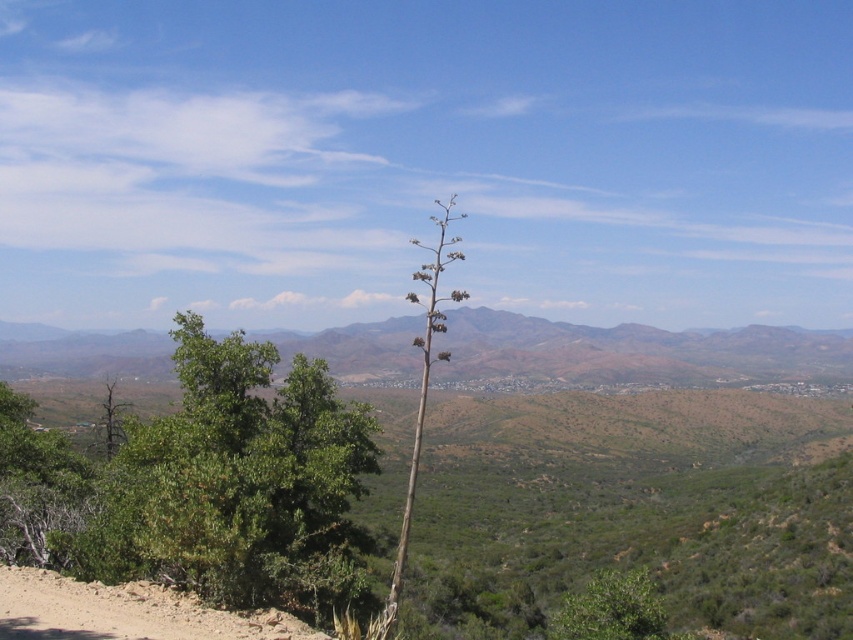
Is point (258, 465) positioned behind point (784, 371)?

No, (258, 465) is closer to viewer.

Consider the image. Is green leafy tree at left smaller than brown/dry grassland at center?

Yes.

Is point (236, 572) closer to viewer compared to point (813, 371)?

Yes, point (236, 572) is closer to viewer.

The image size is (853, 640). I want to click on green leafy tree at left, so click(241, 484).

Is green leafy tree at left thinner than green leafy tree at lower right?

No.

From the picture: Does green leafy tree at left have a greater width compared to green leafy tree at lower right?

Yes, green leafy tree at left is wider than green leafy tree at lower right.

Is point (160, 458) positioned in front of point (569, 614)?

That is False.

The height and width of the screenshot is (640, 853). I want to click on green leafy tree at left, so click(241, 484).

Is green leafy tree at lower right below green woody at center?

Correct, green leafy tree at lower right is located below green woody at center.

Can you confirm if green leafy tree at lower right is smaller than green woody at center?

Indeed, green leafy tree at lower right has a smaller size compared to green woody at center.

You are a GUI agent. You are given a task and a screenshot of the screen. Output one action in this format:
    pyautogui.click(x=<x>, y=<y>)
    Task: Click on the green leafy tree at lower right
    The height and width of the screenshot is (640, 853).
    Given the screenshot: What is the action you would take?
    pyautogui.click(x=611, y=609)

You are a GUI agent. You are given a task and a screenshot of the screen. Output one action in this format:
    pyautogui.click(x=<x>, y=<y>)
    Task: Click on the green leafy tree at lower right
    This screenshot has width=853, height=640.
    Given the screenshot: What is the action you would take?
    click(x=611, y=609)